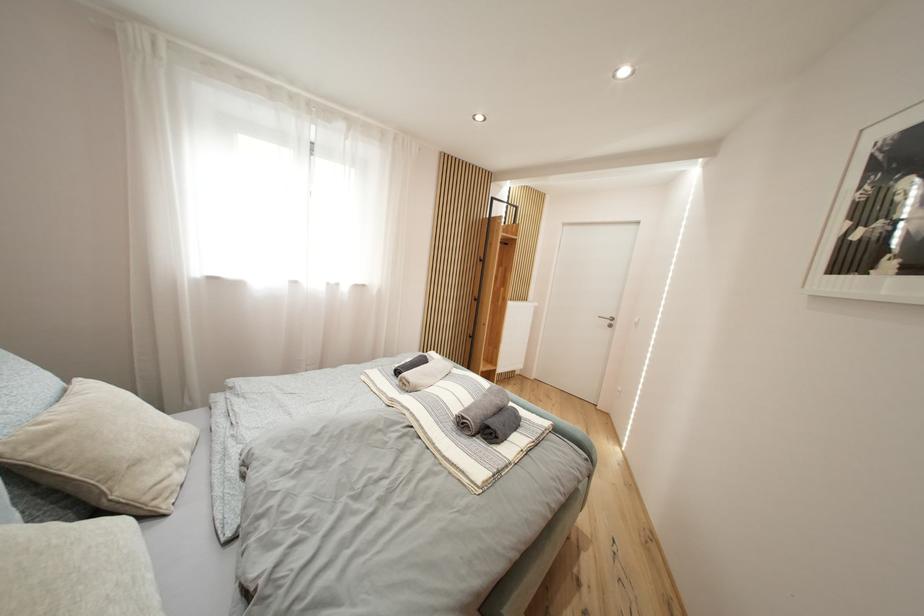
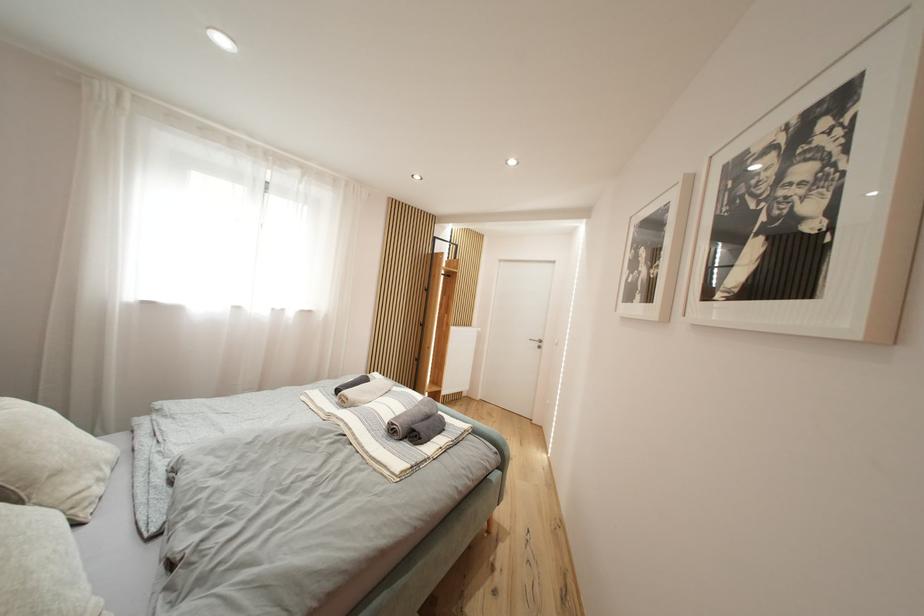
Question: The first image is from the beginning of the video and the second image is from the end. How did the camera likely rotate when shooting the video?

Choices:
 (A) Left
 (B) Right
 (C) Up
 (D) Down

Answer: (B)